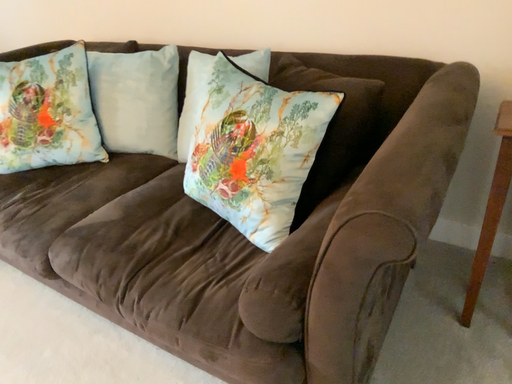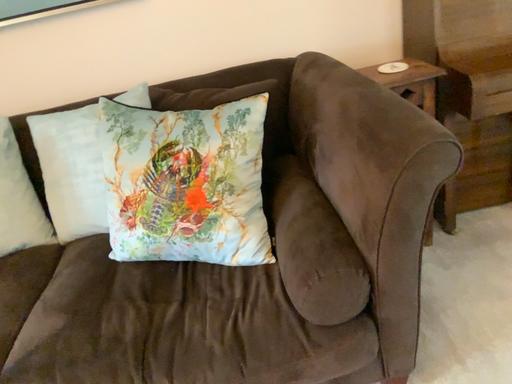
Question: Which way did the camera rotate in the video?

Choices:
 (A) rotated upward
 (B) rotated downward

Answer: (A)